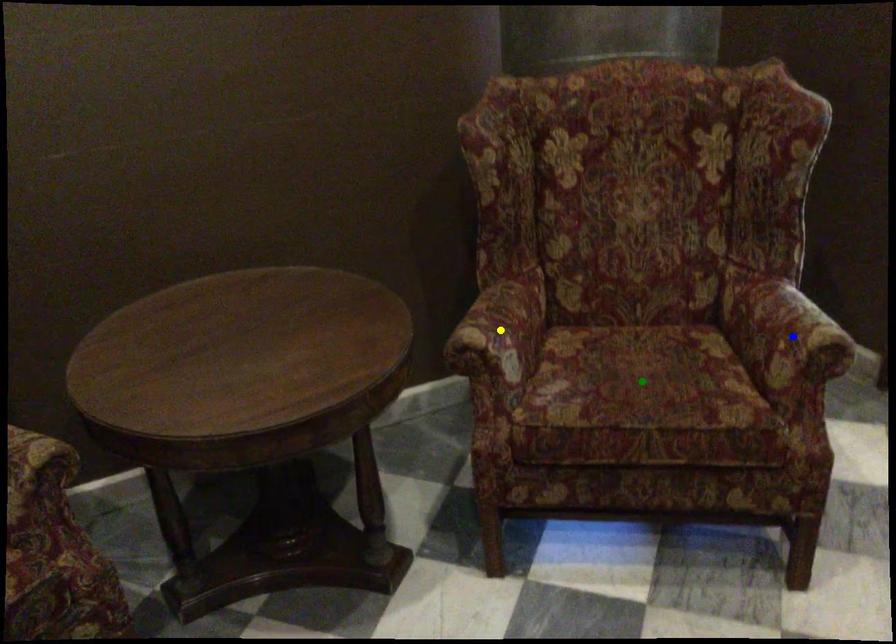
Order these from farthest to nearest:
blue point
yellow point
green point

yellow point < green point < blue point